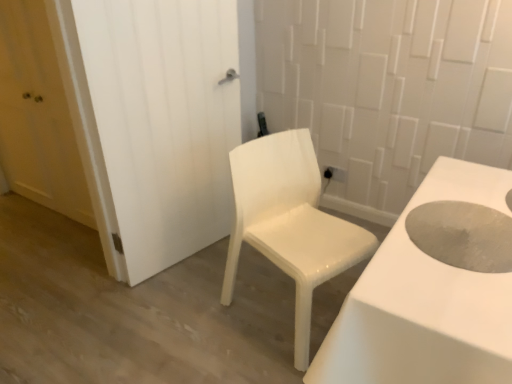
Where is `empty space that is in between white glossy chair at center and white matte door at center, marked as the second door in a left-to-right arrangement`? empty space that is in between white glossy chair at center and white matte door at center, marked as the second door in a left-to-right arrangement is located at coordinates (208, 292).